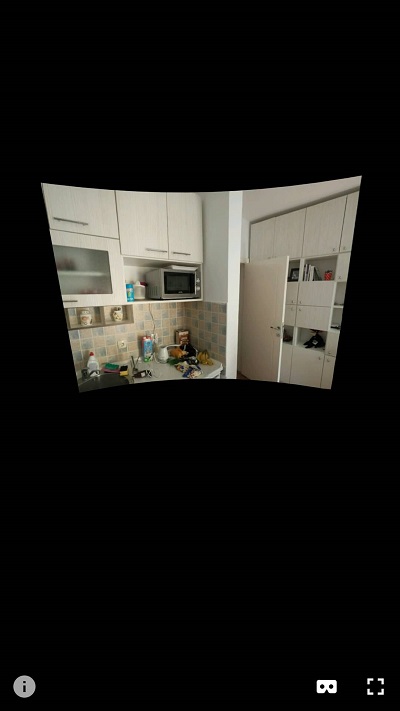
Identify the location of curved rectangular image of a kitchen. The height and width of the screenshot is (711, 400). (215, 284).